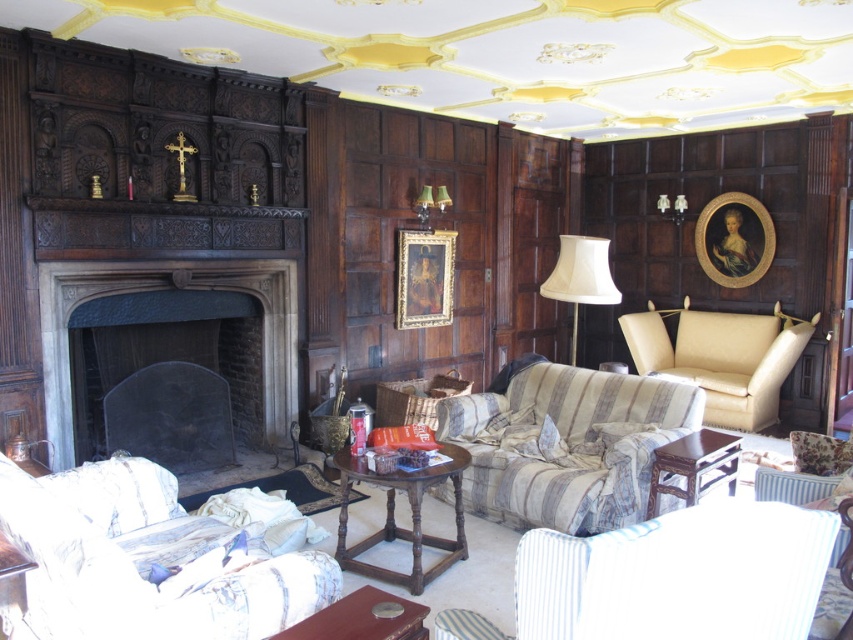
Which is below, white striped fabric armchair at lower right or green fabric lampshade at upper center?

white striped fabric armchair at lower right

Between point (630, 598) and point (428, 193), which one is positioned behind?

Positioned behind is point (428, 193).

The image size is (853, 640). What are the coordinates of `white striped fabric armchair at lower right` in the screenshot? It's located at (677, 576).

Is white striped fabric armchair at lower right taller than gold/gilded wood portrait at center?

Incorrect, white striped fabric armchair at lower right's height is not larger of gold/gilded wood portrait at center's.

Describe the element at coordinates (677, 576) in the screenshot. I see `white striped fabric armchair at lower right` at that location.

The height and width of the screenshot is (640, 853). I want to click on white striped fabric armchair at lower right, so click(677, 576).

Is goldwooden frame at upper right above wooden coffee table at center?

Correct, goldwooden frame at upper right is located above wooden coffee table at center.

Is point (759, 230) positioned in front of point (376, 611)?

No, it is behind (376, 611).

Who is more forward, (715,204) or (395,624)?

Point (395,624) is in front.

Identify the location of goldwooden frame at upper right. (734, 240).